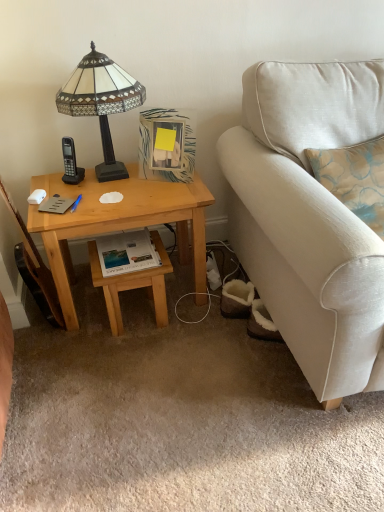
Image resolution: width=384 pixels, height=512 pixels. I want to click on vacant space in stained glass lampshade at upper left (from a real-world perspective), so click(x=118, y=173).